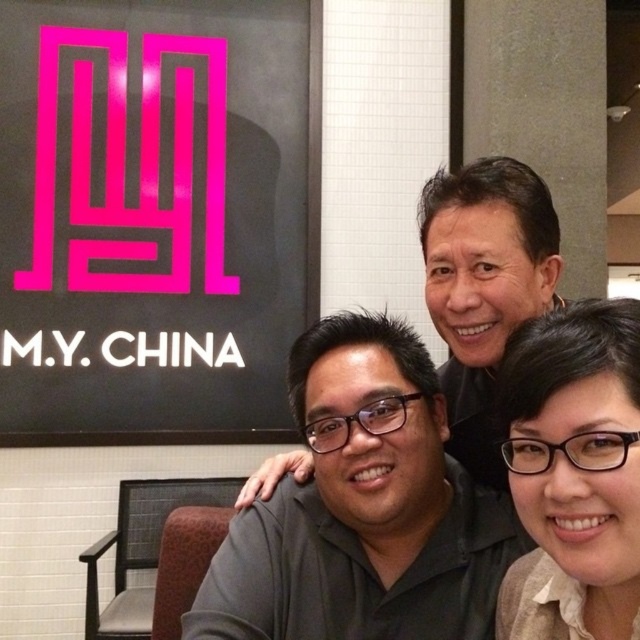
You are a photographer standing at a distance of 40 inches from the subject. You want to take a closeup shot of the matte black shirt at center. Is the current distance sufficient for a clear closeup?

The matte black shirt at center is only 36.75 inches away from the camera, which is closer than your current position of 40 inches. To capture a clear closeup, you should move 3.25 inches closer to the subject.

Consider the image. You are a photographer setting up for a group photo. You notice the matte black shirt at center and the matte black glasses at lower right. Which object should you adjust to ensure both are visible in the frame?

You should adjust the matte black glasses at lower right because the matte black shirt at center is positioned under it, which may cause the glasses to block the view of the shirt.